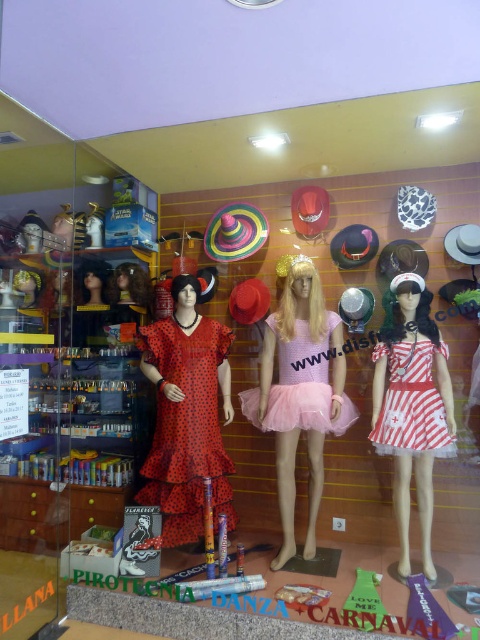
You are a customer in the costume shop and see the pink crochet tutu at center and the pink tulle dress at center. Which one is positioned lower on the mannequin?

The pink crochet tutu at center is positioned below the pink tulle dress at center, so the pink crochet tutu at center is lower on the mannequin.